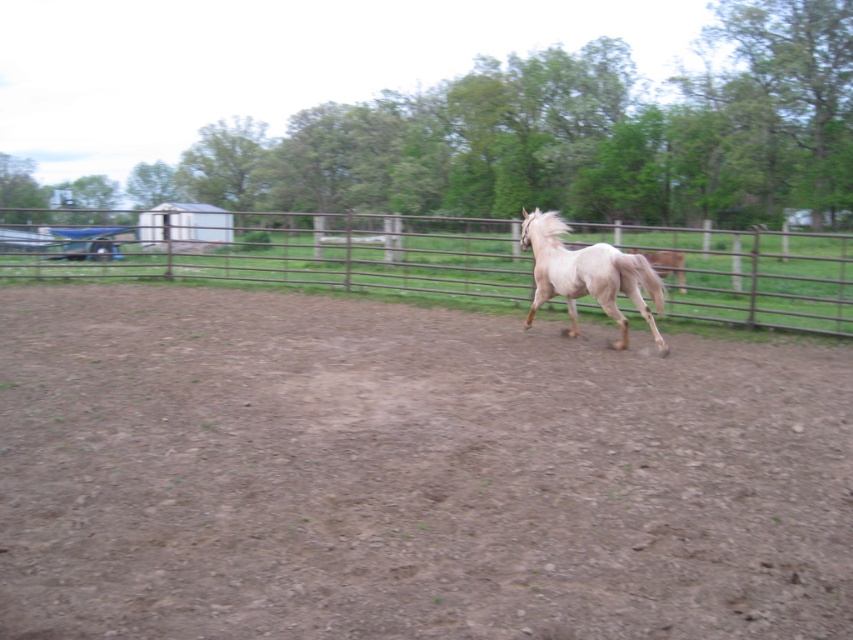
Does brown dirt field at center have a smaller size compared to rusty metal fence at center?

Correct, brown dirt field at center occupies less space than rusty metal fence at center.

Is brown dirt field at center above rusty metal fence at center?

Actually, brown dirt field at center is below rusty metal fence at center.

Between point (733, 372) and point (473, 244), which one is positioned in front?

Point (733, 372)

I want to click on brown dirt field at center, so click(x=407, y=474).

Does brown dirt field at center have a greater width compared to pale beige horse at center?

Indeed, brown dirt field at center has a greater width compared to pale beige horse at center.

Is point (764, 628) behind point (656, 276)?

No.

Identify the location of brown dirt field at center. (407, 474).

Which is behind, point (334, 232) or point (556, 243)?

Point (334, 232)

Which is above, rusty metal fence at center or pale beige horse at center?

rusty metal fence at center is above.

Locate an element on the screen. rusty metal fence at center is located at coordinates (289, 252).